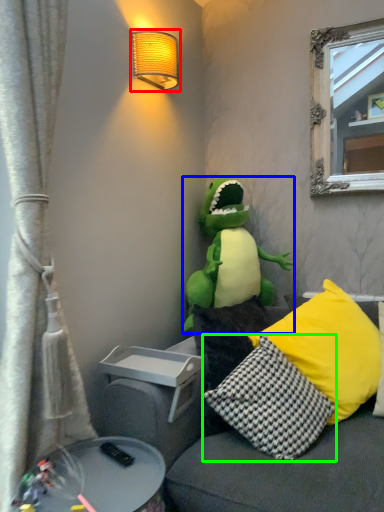
Question: Which is nearer to the lamp (highlighted by a red box)? toy (highlighted by a blue box) or pillow (highlighted by a green box).

Choices:
 (A) toy
 (B) pillow

Answer: (A)